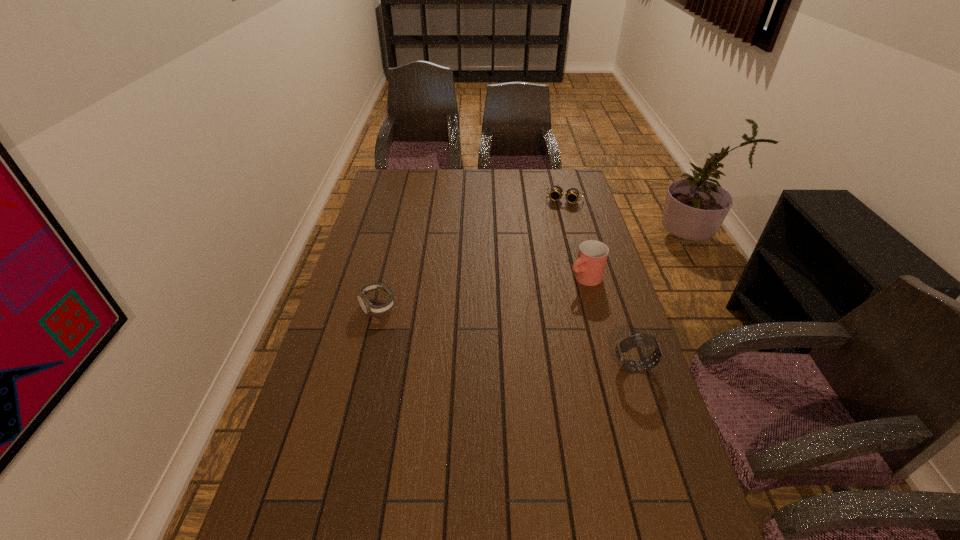
This screenshot has height=540, width=960. In order to click on the shorter watch in this screenshot , I will do `click(368, 308)`.

Where is `the second shortest object`? Image resolution: width=960 pixels, height=540 pixels. the second shortest object is located at coordinates (368, 308).

I want to click on the right watch, so click(x=622, y=347).

Identify the location of the taller watch. The image size is (960, 540). (622, 347).

This screenshot has width=960, height=540. In order to click on the farthest object in this screenshot , I will do `click(556, 192)`.

Where is `goggles`? goggles is located at coordinates (556, 192).

Find the location of `the second farthest object`. the second farthest object is located at coordinates (589, 267).

Find the location of `free space located on the face of the shorter watch`. free space located on the face of the shorter watch is located at coordinates (347, 431).

Image resolution: width=960 pixels, height=540 pixels. In order to click on vacant space situated on the face of the taller watch in this screenshot , I will do `click(477, 367)`.

Where is `vacant space situated on the face of the taller watch`? vacant space situated on the face of the taller watch is located at coordinates (473, 367).